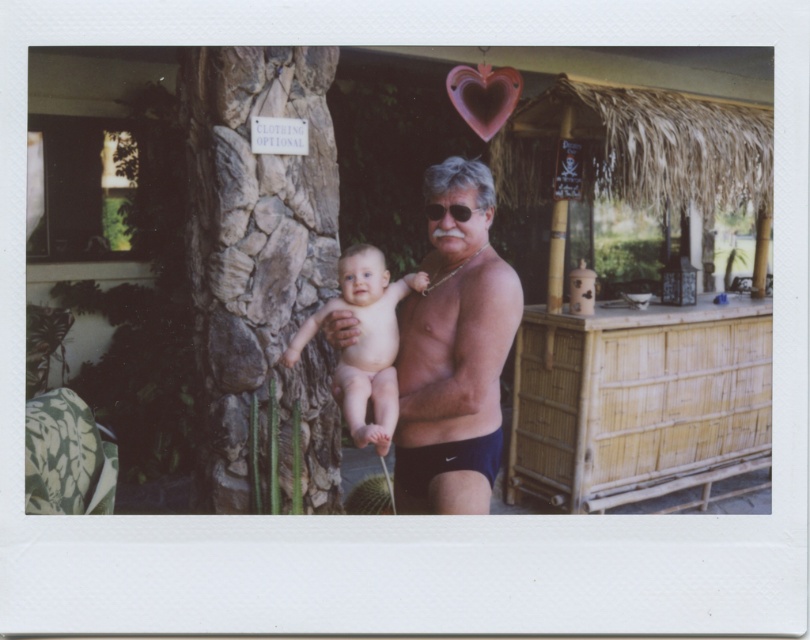
Question: Which point is closer to the camera?

Choices:
 (A) bamboo hut at center
 (B) shiny black shorts at center
 (C) brown rough stone tree trunk at left
 (D) muscular tan skin at center

Answer: (D)

Question: Which object is the farthest from the smooth skin baby at center?

Choices:
 (A) shiny black shorts at center
 (B) brown rough stone tree trunk at left

Answer: (B)

Question: Can you confirm if bamboo hut at center is positioned to the left of dark blue nylon shorts at center?

Choices:
 (A) yes
 (B) no

Answer: (B)

Question: Is brown rough stone tree trunk at left further to the viewer compared to smooth skin baby at center?

Choices:
 (A) yes
 (B) no

Answer: (A)

Question: Which object is positioned closest to the dark blue nylon shorts at center?

Choices:
 (A) bamboo hut at center
 (B) brown rough stone tree trunk at left
 (C) muscular tan skin at center

Answer: (C)

Question: Can you confirm if brown rough stone tree trunk at left is positioned to the left of muscular tan skin at center?

Choices:
 (A) yes
 (B) no

Answer: (A)